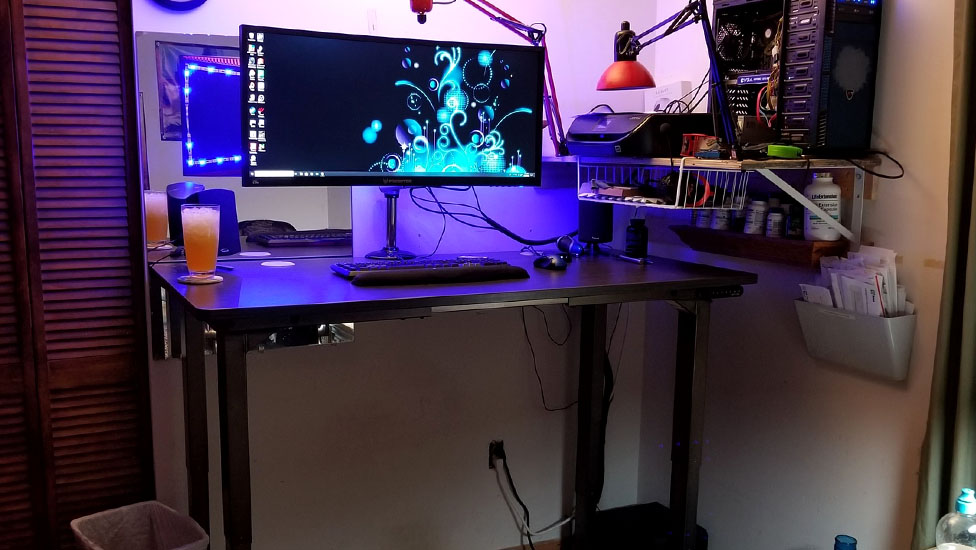
At what (x,y) coordinates should I click in order to perform the action: click on coaster. Please return your answer as a coordinate pair (x, y). Image resolution: width=976 pixels, height=550 pixels. Looking at the image, I should click on (194, 278).